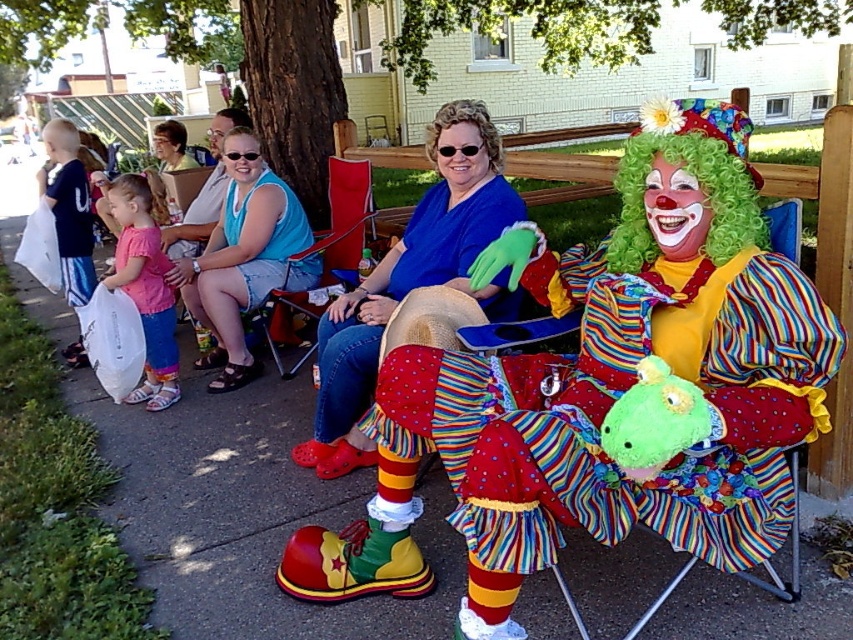
Is blue cotton shirt at center to the right of blue denim shorts at center from the viewer's perspective?

Correct, you'll find blue cotton shirt at center to the right of blue denim shorts at center.

Is point (486, 156) farther from camera compared to point (256, 172)?

No, it is not.

Locate an element on the screen. Image resolution: width=853 pixels, height=640 pixels. blue cotton shirt at center is located at coordinates pyautogui.click(x=410, y=280).

Is pink fabric dress at left smaller than red fabric chair at center?

Yes, pink fabric dress at left is smaller than red fabric chair at center.

Does point (132, 228) lie behind point (280, 294)?

No, it is in front of (280, 294).

Where is `pink fabric dress at left`? pink fabric dress at left is located at coordinates (144, 289).

Locate an element on the screen. blue denim shorts at center is located at coordinates pyautogui.click(x=247, y=253).